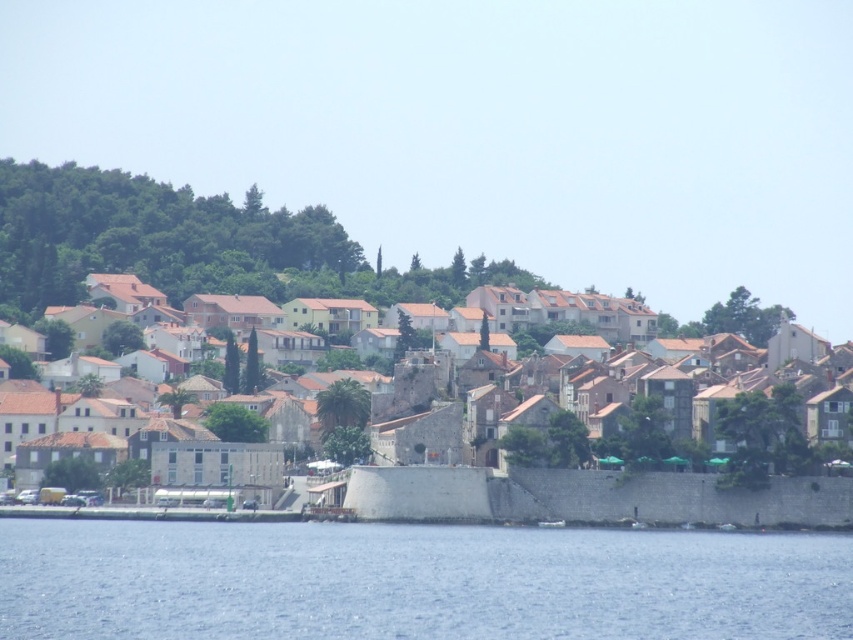
Is point (601, 560) farther from camera compared to point (531, 460)?

That is False.

Does blue water at lower center have a larger size compared to brown stone town at center?

Actually, blue water at lower center might be smaller than brown stone town at center.

Describe the element at coordinates (415, 582) in the screenshot. I see `blue water at lower center` at that location.

The image size is (853, 640). I want to click on blue water at lower center, so click(415, 582).